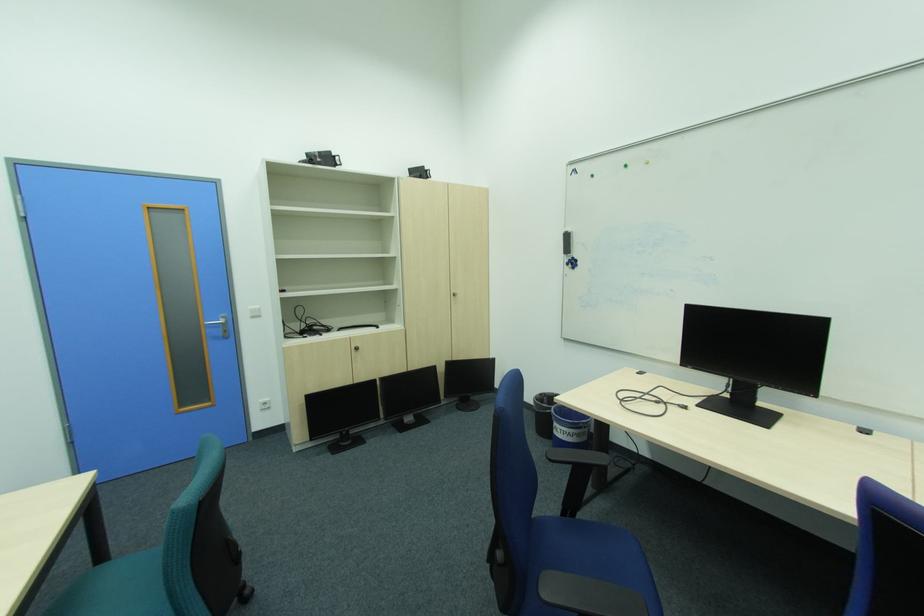
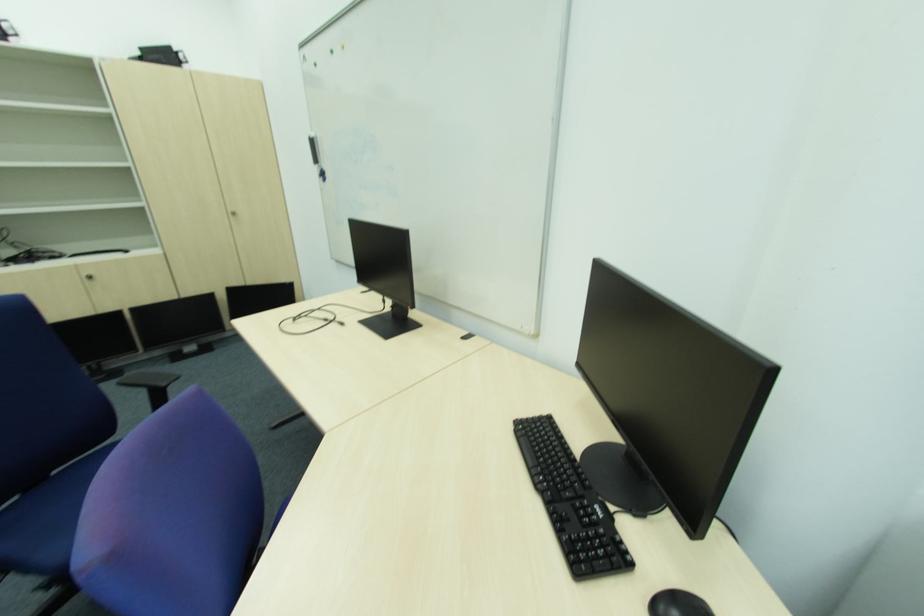
Question: Which direction would the cameraman need to move to produce the second image? Reply with the corresponding letter.

Choices:
 (A) Left
 (B) Right
 (C) Forward
 (D) Backward

Answer: (B)